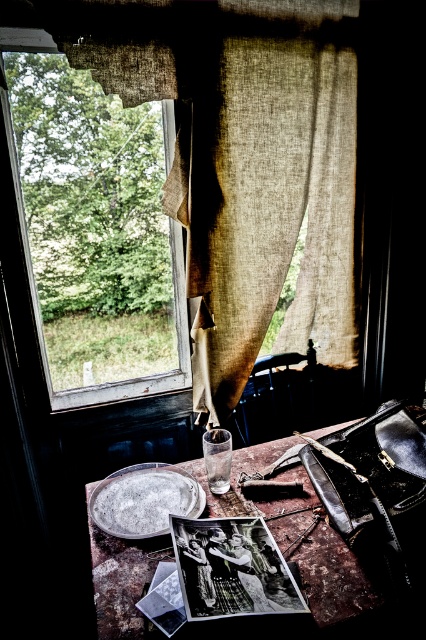
Question: Among these objects, which one is farthest from the camera?

Choices:
 (A) burlap curtain at upper left
 (B) silver metallic plate at center

Answer: (A)

Question: Is burlap curtain at upper left to the left of rusty metal table at center from the viewer's perspective?

Choices:
 (A) yes
 (B) no

Answer: (B)

Question: Is burlap curtain at upper left to the right of transparent glass window at upper left from the viewer's perspective?

Choices:
 (A) yes
 (B) no

Answer: (A)

Question: Considering the real-world distances, which object is closest to the silver metallic plate at center?

Choices:
 (A) transparent glass window at upper left
 (B) rusty metal table at center

Answer: (B)

Question: Can you confirm if transparent glass window at upper left is positioned above rusty metal table at center?

Choices:
 (A) yes
 (B) no

Answer: (A)

Question: Based on their relative distances, which object is farther from the transparent glass window at upper left?

Choices:
 (A) burlap curtain at upper left
 (B) rusty metal table at center

Answer: (B)